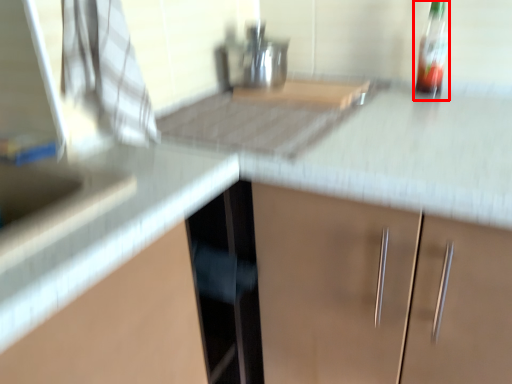
Question: From the image, what is the correct spatial relationship of bottle (annotated by the red box) in relation to counter top?

Choices:
 (A) left
 (B) right

Answer: (B)